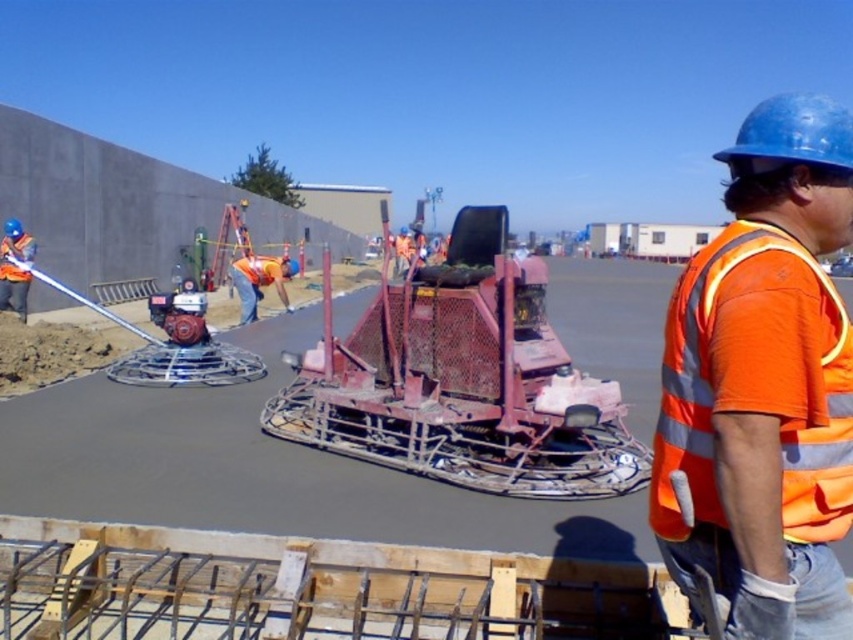
Question: Is orange reflective vest at center above rusty metal machine at center?

Choices:
 (A) yes
 (B) no

Answer: (A)

Question: Is orange reflective vest at center bigger than rusty metal machine at center?

Choices:
 (A) no
 (B) yes

Answer: (A)

Question: Does orange reflective vest at center appear over rusty metal machine at center?

Choices:
 (A) yes
 (B) no

Answer: (A)

Question: Which object appears closest to the camera in this image?

Choices:
 (A) orange reflective vest at center
 (B) rusty metal machine at center

Answer: (A)